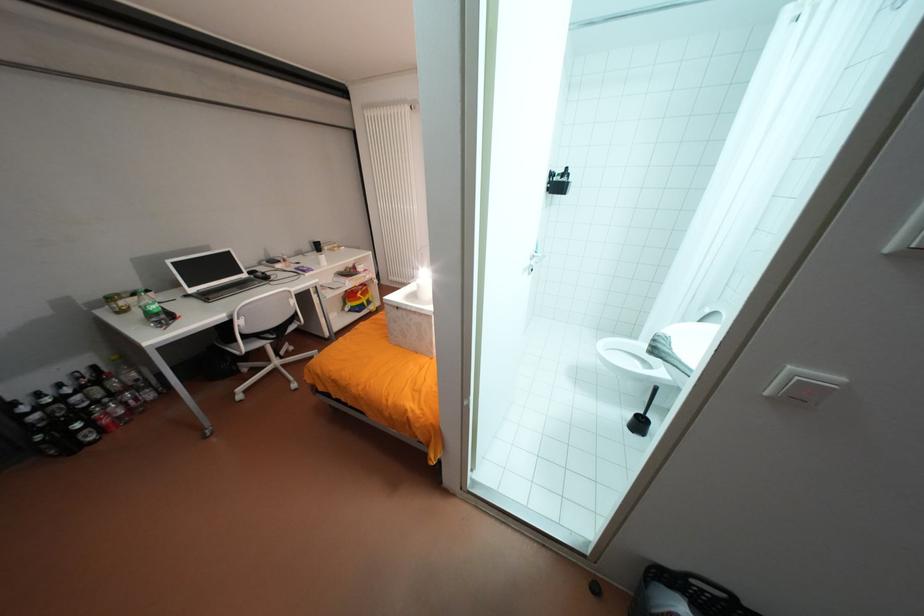
You are a GUI agent. You are given a task and a screenshot of the screen. Output one action in this format:
    pyautogui.click(x=<x>, y=<y>)
    Task: Click on the black toilet brush
    The height and width of the screenshot is (616, 924).
    Given the screenshot: What is the action you would take?
    pyautogui.click(x=641, y=416)